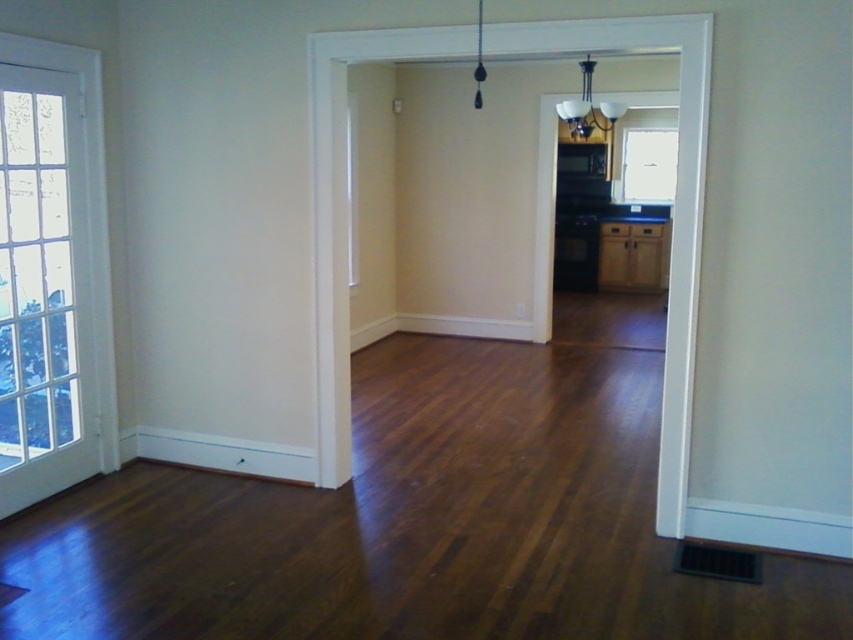
Is point (631, 240) farther from camera compared to point (625, 134)?

That is False.

Is brown wood cabinet at center further to the viewer compared to clear glass window at upper center?

No, it is in front of clear glass window at upper center.

Between point (645, 284) and point (648, 147), which one is positioned in front?

Point (645, 284) is in front.

The width and height of the screenshot is (853, 640). Find the location of `brown wood cabinet at center`. brown wood cabinet at center is located at coordinates (633, 253).

How much distance is there between clear glass door at left and brown wood cabinet at center?

The distance of clear glass door at left from brown wood cabinet at center is 21.92 feet.

Who is taller, clear glass door at left or brown wood cabinet at center?

With more height is clear glass door at left.

Does point (96, 221) come farther from viewer compared to point (654, 273)?

No, it is in front of (654, 273).

Where is `clear glass door at left`? Image resolution: width=853 pixels, height=640 pixels. clear glass door at left is located at coordinates coord(51,273).

Where is `clear glass door at left`? clear glass door at left is located at coordinates (51, 273).

Can you confirm if clear glass door at left is smaller than clear glass window at upper center?

Incorrect, clear glass door at left is not smaller in size than clear glass window at upper center.

Locate an element on the screen. The width and height of the screenshot is (853, 640). clear glass door at left is located at coordinates coord(51,273).

Find the location of a particular element. Image resolution: width=853 pixels, height=640 pixels. clear glass door at left is located at coordinates (51, 273).